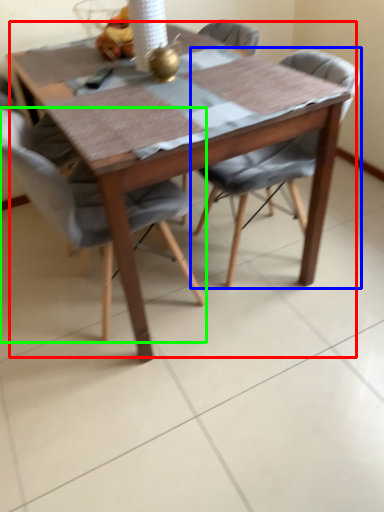
Question: Which is nearer to the kitchen & dining room table (highlighted by a red box)? chair (highlighted by a blue box) or chair (highlighted by a green box).

Choices:
 (A) chair
 (B) chair

Answer: (B)